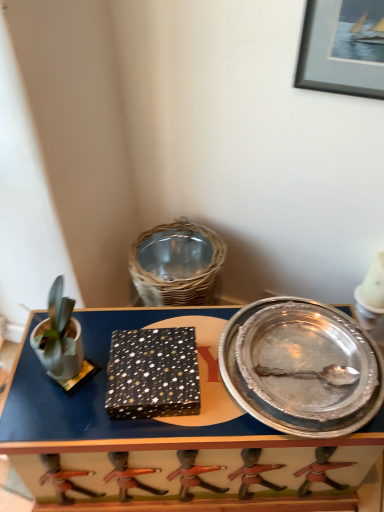
Find the location of a particular element. empty space that is ontop of metallic silver tray at center is located at coordinates (204, 377).